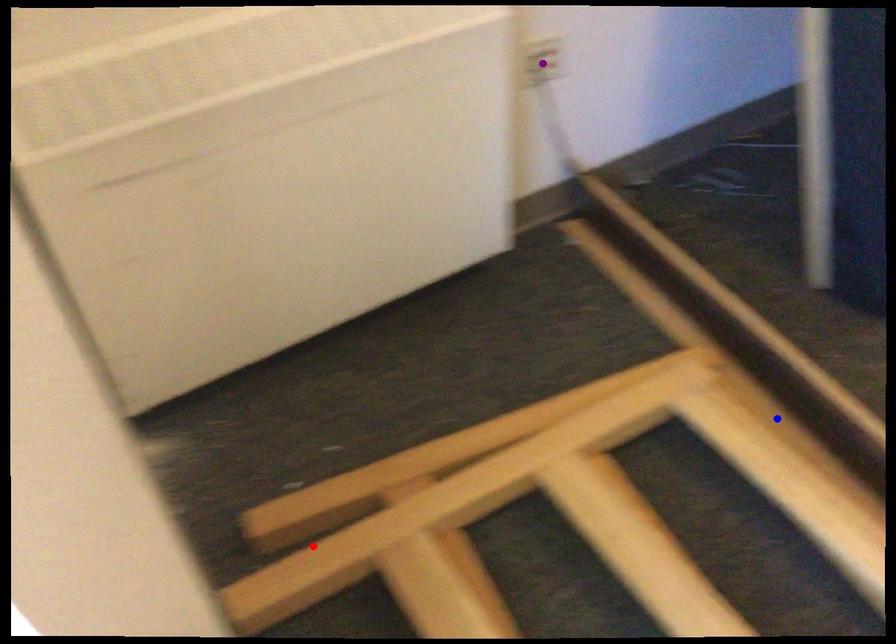
Order these from nearest to farthest:
1. red point
2. blue point
3. purple point

purple point, blue point, red point